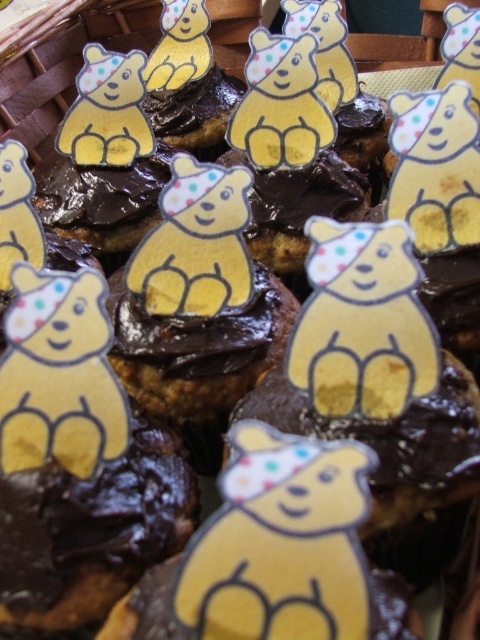
Is matte yellow bear at center bigger than matte yellow bear at lower left?

Yes.

Which is in front, point (343, 259) or point (115, 456)?

Point (343, 259) is more forward.

Find the location of `matte yellow bear at center`. matte yellow bear at center is located at coordinates (361, 323).

Where is `matte yellow bear at center`? The image size is (480, 640). matte yellow bear at center is located at coordinates (361, 323).

Between matte yellow bear at center and matte yellow bear at upper left, which one appears on the right side from the viewer's perspective?

Positioned to the right is matte yellow bear at center.

The width and height of the screenshot is (480, 640). What do you see at coordinates (361, 323) in the screenshot?
I see `matte yellow bear at center` at bounding box center [361, 323].

Identify the location of matte yellow bear at center. This screenshot has height=640, width=480. (361, 323).

Between point (38, 374) and point (135, 122), which one is positioned in front?

Point (38, 374) is more forward.

Is matte yellow bear at lower left positioned in front of matte yellow bear at upper left?

Yes.

Where is `matte yellow bear at lower left`? This screenshot has height=640, width=480. matte yellow bear at lower left is located at coordinates (59, 374).